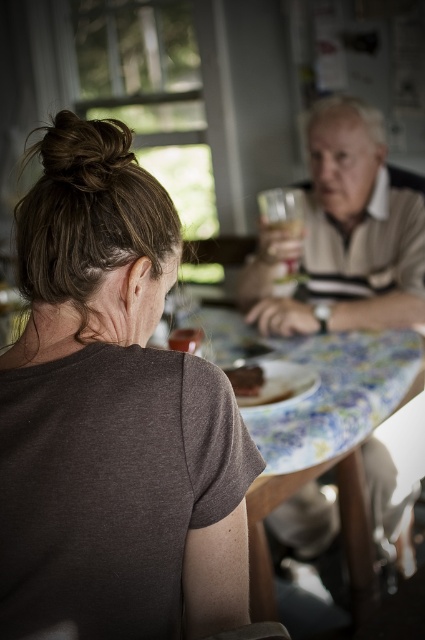
You are standing in front of the table where the matte brown plate at center is placed. If you want to reach the plate without moving your feet, can you do it?

The matte brown plate at center is 4.28 feet from viewer, so you cannot reach it without moving your feet since the average arm length is shorter than that distance.